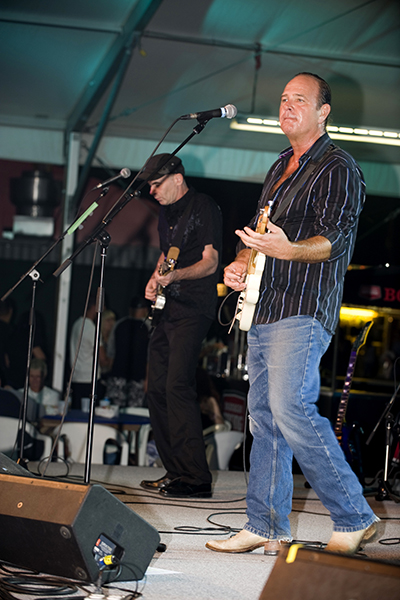
Find the location of `neon sign`. neon sign is located at coordinates (384, 293).